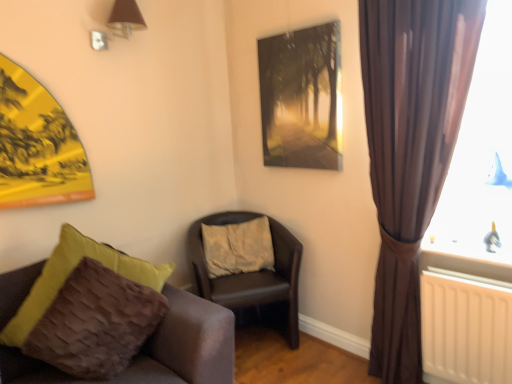
Question: Is metallic silver picture frame at upper center aimed at leather-like brown chair at center, arranged as the first chair when viewed from the back?

Choices:
 (A) yes
 (B) no

Answer: (B)

Question: Does metallic silver picture frame at upper center have a smaller size compared to leather-like brown chair at center, which is the second chair from front to back?

Choices:
 (A) yes
 (B) no

Answer: (A)

Question: From a real-world perspective, is metallic silver picture frame at upper center positioned over leather-like brown chair at center, arranged as the first chair when viewed from the back, based on gravity?

Choices:
 (A) yes
 (B) no

Answer: (A)

Question: Is metallic silver picture frame at upper center thinner than leather-like brown chair at center, which is the second chair from front to back?

Choices:
 (A) yes
 (B) no

Answer: (A)

Question: Is leather-like brown chair at center, arranged as the first chair when viewed from the back, surrounded by metallic silver picture frame at upper center?

Choices:
 (A) no
 (B) yes

Answer: (A)

Question: Looking at their shapes, would you say brown textured cushion at lower left, which appears as the 2th chair when viewed from the back, is wider or thinner than matte brown lampshade at upper left?

Choices:
 (A) wide
 (B) thin

Answer: (A)

Question: From the image's perspective, is brown textured cushion at lower left, which is counted as the 1th chair, starting from the front, located above or below matte brown lampshade at upper left?

Choices:
 (A) below
 (B) above

Answer: (A)

Question: Is brown textured cushion at lower left, which appears as the 2th chair when viewed from the back, spatially inside matte brown lampshade at upper left, or outside of it?

Choices:
 (A) outside
 (B) inside

Answer: (A)

Question: Is brown textured cushion at lower left, which appears as the 2th chair when viewed from the back, to the left or to the right of matte brown lampshade at upper left in the image?

Choices:
 (A) left
 (B) right

Answer: (A)

Question: Considering their positions, is brown satin curtain at right located in front of or behind matte brown lampshade at upper left?

Choices:
 (A) behind
 (B) front

Answer: (B)

Question: Does point (410, 322) appear closer or farther from the camera than point (96, 41)?

Choices:
 (A) closer
 (B) farther

Answer: (A)

Question: From the image's perspective, relative to matte brown lampshade at upper left, is brown satin curtain at right above or below?

Choices:
 (A) above
 (B) below

Answer: (B)

Question: Looking at their shapes, would you say brown satin curtain at right is wider or thinner than matte brown lampshade at upper left?

Choices:
 (A) thin
 (B) wide

Answer: (A)

Question: Is brown textured cushion at lower left, which is counted as the 1th chair, starting from the front, wider or thinner than metallic silver picture frame at upper center?

Choices:
 (A) wide
 (B) thin

Answer: (A)

Question: Is brown textured cushion at lower left, which appears as the 2th chair when viewed from the back, inside or outside of metallic silver picture frame at upper center?

Choices:
 (A) outside
 (B) inside

Answer: (A)